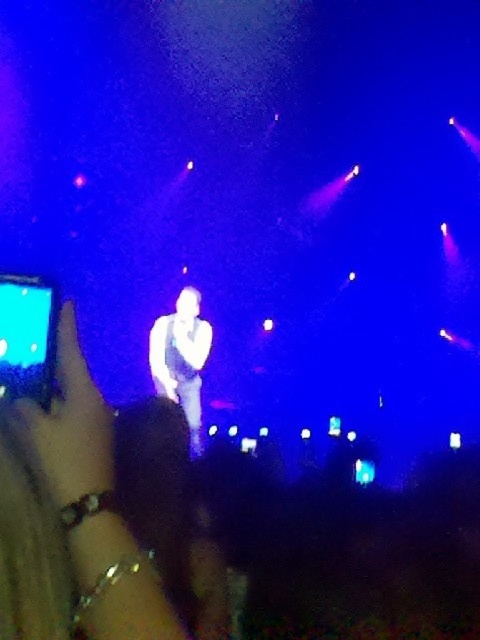
Who is shorter, white matte shirt at center or metallic bracelet at lower left?

metallic bracelet at lower left is shorter.

Between white matte shirt at center and metallic bracelet at lower left, which one is positioned higher?

Positioned higher is metallic bracelet at lower left.

Between point (160, 369) and point (72, 394), which one is positioned in front?

Point (72, 394)

This screenshot has width=480, height=640. In order to click on white matte shirt at center in this screenshot , I will do `click(181, 358)`.